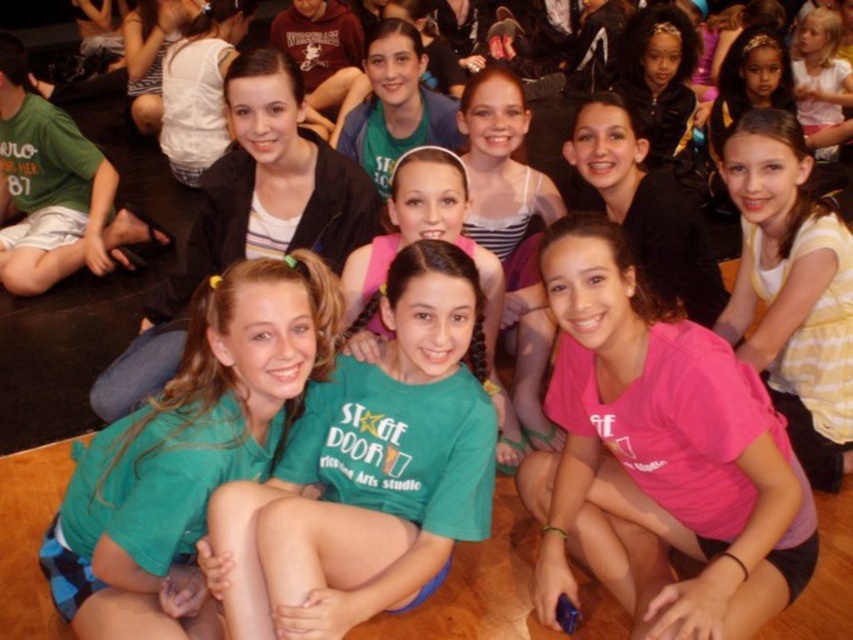
You are a photographer trying to capture a clear shot of the green matte shirt at center and the green fabric shirt at center. Which one is closer to the camera?

The green matte shirt at center is in front of the green fabric shirt at center, so the green matte shirt at center is closer to the camera.

You are standing in the dance studio and want to hand a water bottle to the girl wearing the pink matte shirt at lower right. If you can reach 6 feet, will you be able to reach her without moving?

The pink matte shirt at lower right is 5.66 feet away from the viewer, so yes, you can reach her with your 6 feet reach.